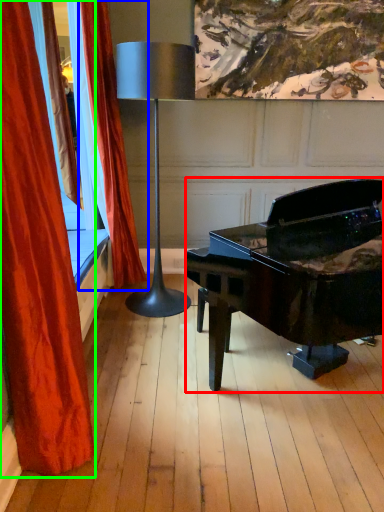
Question: Estimate the real-world distances between objects in this image. Which object is farther from piano (highlighted by a red box), curtain (highlighted by a blue box) or curtain (highlighted by a green box)?

Choices:
 (A) curtain
 (B) curtain

Answer: (B)